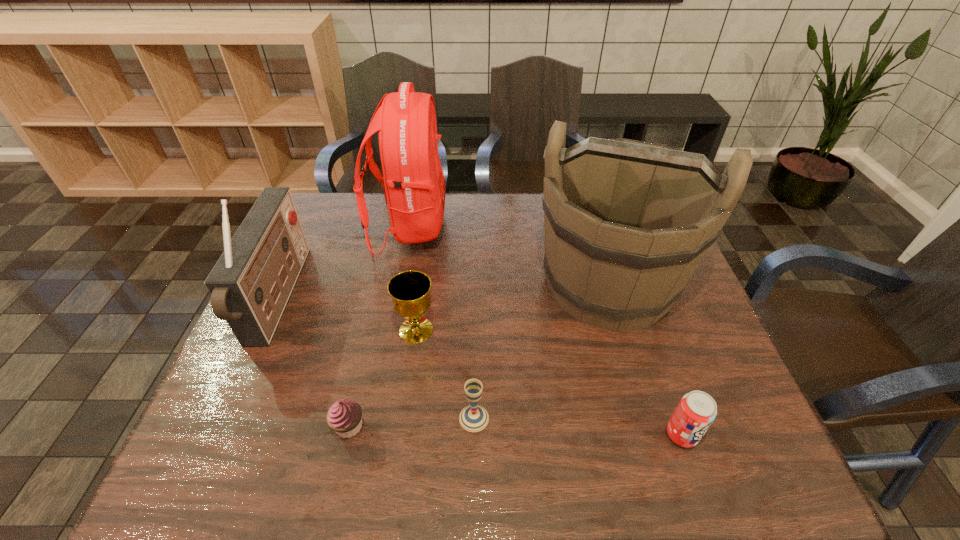
I want to click on free spot that satisfies the following two spatial constraints: 1. on the main compartment of the backpack; 2. on the back side of the farther chalice, so pyautogui.click(x=390, y=330).

Locate an element on the screen. vacant space that satisfies the following two spatial constraints: 1. on the front panel of the leftmost object; 2. on the back side of the soda can is located at coordinates (218, 435).